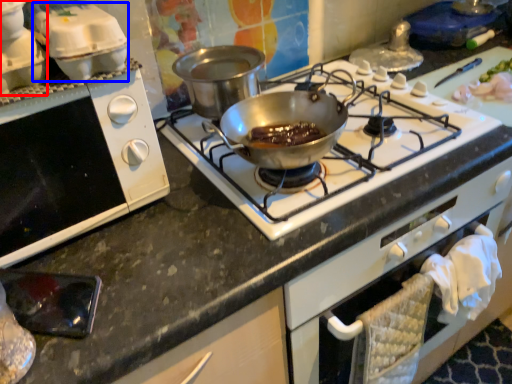
Question: Among these objects, which one is nearest to the camera, kitchen appliance (highlighted by a red box) or appliance (highlighted by a blue box)?

Choices:
 (A) kitchen appliance
 (B) appliance

Answer: (A)